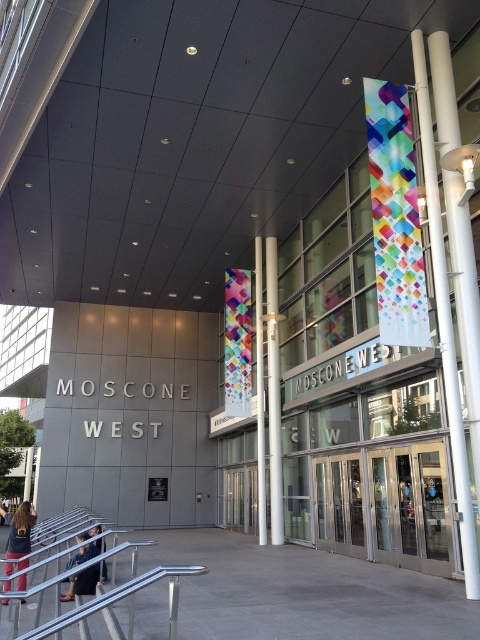
You are standing in front of the Moscone West building and see the white glossy pole at center and the dark blue jacket at lower left. Which object is closer to you?

The white glossy pole at center is closer to you because it is further to the viewer than the dark blue jacket at lower left.